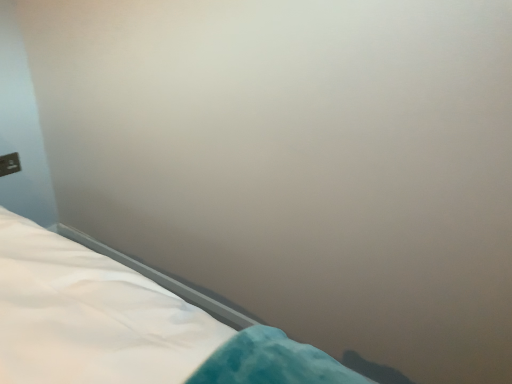
Question: Visually, is white fabric bed at lower left positioned to the left or to the right of matte black outlet at upper left?

Choices:
 (A) right
 (B) left

Answer: (A)

Question: Is white fabric bed at lower left wider or thinner than matte black outlet at upper left?

Choices:
 (A) thin
 (B) wide

Answer: (B)

Question: Relative to matte black outlet at upper left, is white fabric bed at lower left in front or behind?

Choices:
 (A) front
 (B) behind

Answer: (A)

Question: Is matte black outlet at upper left inside or outside of white fabric bed at lower left?

Choices:
 (A) outside
 (B) inside

Answer: (A)

Question: Considering their positions, is matte black outlet at upper left located in front of or behind white fabric bed at lower left?

Choices:
 (A) front
 (B) behind

Answer: (B)

Question: From a real-world perspective, is matte black outlet at upper left positioned above or below white fabric bed at lower left?

Choices:
 (A) below
 (B) above

Answer: (B)

Question: From the image's perspective, relative to white fabric bed at lower left, is matte black outlet at upper left above or below?

Choices:
 (A) above
 (B) below

Answer: (A)